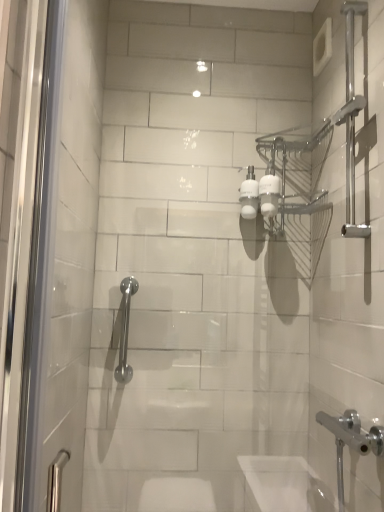
This screenshot has width=384, height=512. Describe the element at coordinates (125, 330) in the screenshot. I see `satin chrome grab bar at center` at that location.

Measure the distance between satin chrome grab bar at center and camera.

They are 25.85 inches apart.

Locate an element on the screen. The height and width of the screenshot is (512, 384). satin chrome grab bar at center is located at coordinates (125, 330).

At what (x,y) coordinates should I click in order to perform the action: click on satin chrome grab bar at center. Please return your answer as a coordinate pair (x, y). Image resolution: width=384 pixels, height=512 pixels. Looking at the image, I should click on (125, 330).